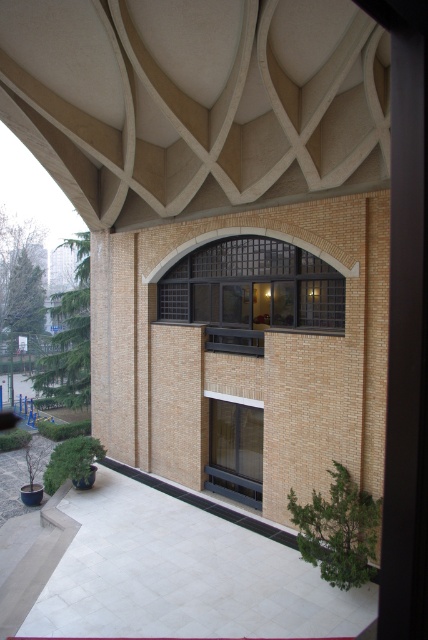
Question: Which point is farther to the camera?

Choices:
 (A) (258, 285)
 (B) (232, 419)

Answer: (A)

Question: Can you confirm if black metal window at center is wider than clear glass window at center?

Choices:
 (A) no
 (B) yes

Answer: (B)

Question: Can you confirm if black metal window at center is positioned to the left of clear glass window at center?

Choices:
 (A) no
 (B) yes

Answer: (B)

Question: Does black metal window at center have a smaller size compared to clear glass window at center?

Choices:
 (A) yes
 (B) no

Answer: (B)

Question: Which point is farther to the camera?

Choices:
 (A) clear glass window at center
 (B) black metal window at center

Answer: (A)